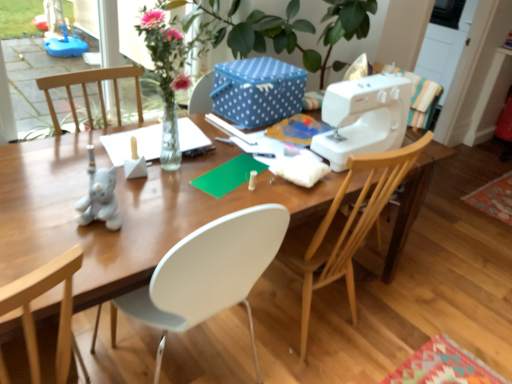
In order to click on spots to the right of wooden chair at right in this screenshot , I will do [395, 318].